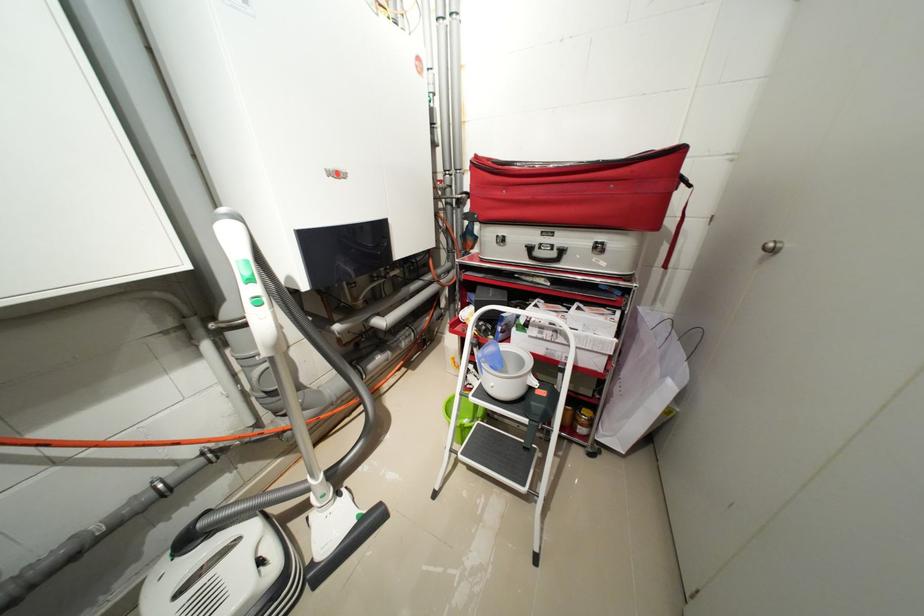
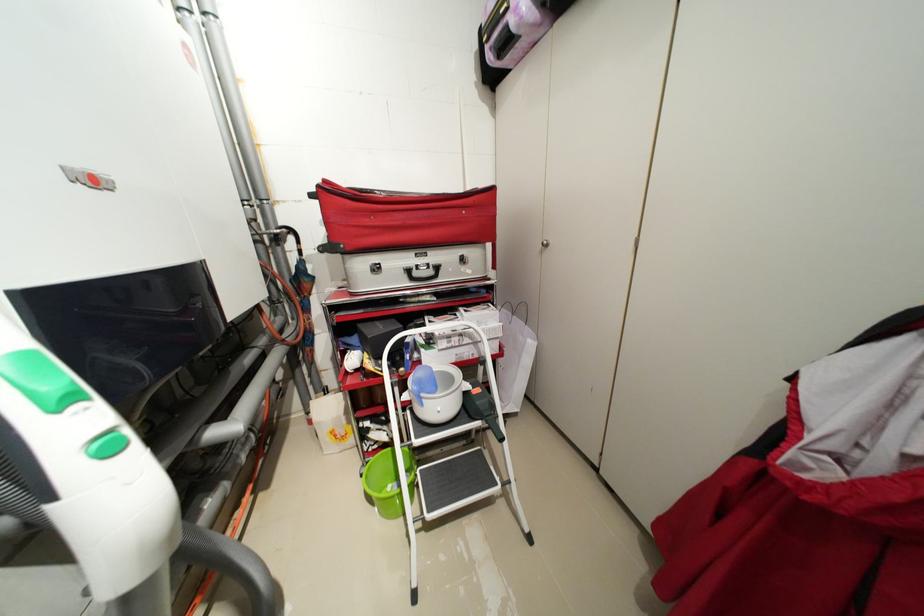
Locate, in the second image, the point that corresponds to (x=551, y=394) in the first image.

(484, 391)